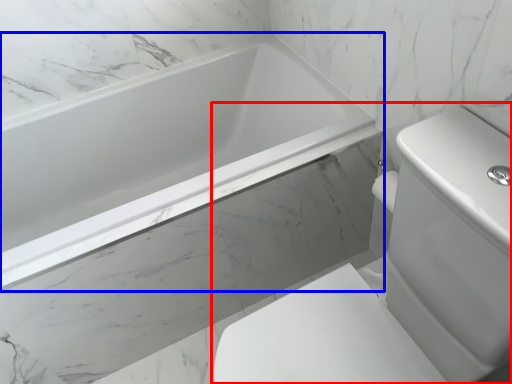
Question: Which point is closer to the camera, sink (highlighted by a red box) or bathtub (highlighted by a blue box)?

Choices:
 (A) sink
 (B) bathtub

Answer: (A)